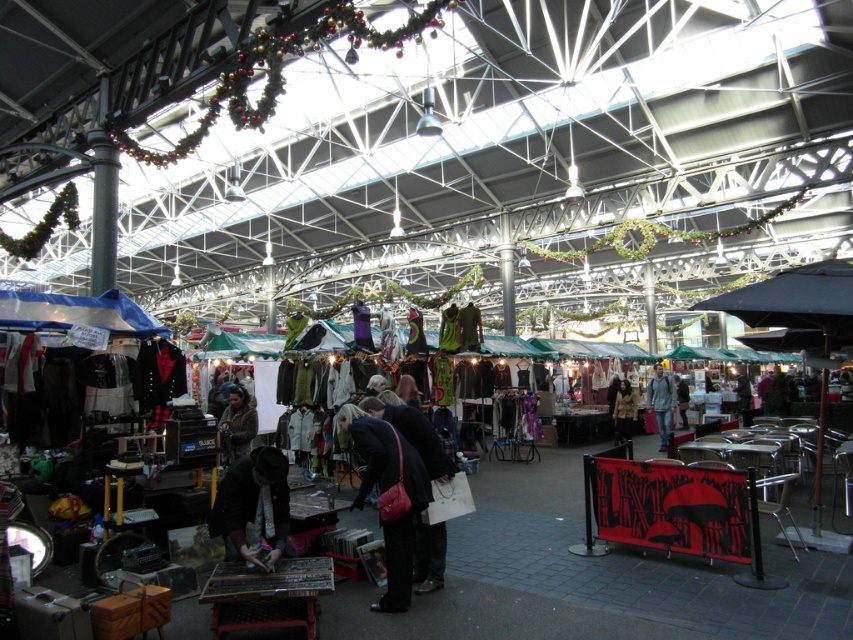
You are standing in the middle of the market and want to take a photo of both the point at coordinates (x=660, y=385) and the point at coordinates (x=622, y=438). Which point should you focus on first to ensure both are in focus?

You should focus on point (x=622, y=438) first because it is farther from the camera than point (x=660, y=385). By focusing on the farther point, both points will be in focus due to the depth of field.

You are a customer in the market and want to compare the dark blue fabric coat at center and the light gray fabric jacket at center. How far apart are these two items?

The dark blue fabric coat at center and light gray fabric jacket at center are 12.92 meters apart.

You are a customer at the market and want to pick up both the light gray fabric jacket at center and the brown wool coat at center. Can you comfortably reach both items without moving your position?

The distance between the light gray fabric jacket at center and the brown wool coat at center is 36.24 inches. Since this distance is within a typical comfortable reaching range, you can comfortably reach both items without moving your position.